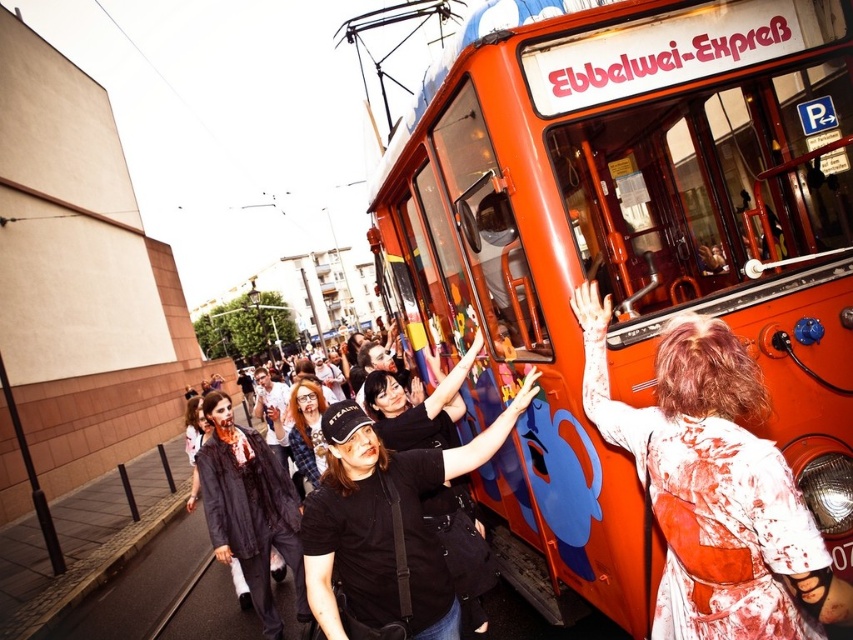
You are standing at the point marked by the coordinates point (625, 248). What object is directly in front of you?

The orange painted metal tram at center is directly in front of you at point (625, 248).

You are a photographer trying to capture a photo of the orange painted metal tram at center and the plaid fabric shirt at center. Which object should you focus on first if you want to ensure both are in focus without adjusting the camera settings?

The orange painted metal tram at center is much taller than the plaid fabric shirt at center, so focusing on the tram first would ensure both are in focus since it is farther away.

You are a photographer standing in the middle of the street. You want to take a photo of the orange painted metal tram at center and the plaid fabric shirt at center. Which object should you focus on first if you want to capture both in the same frame without moving the camera?

You should focus on the plaid fabric shirt at center first because the orange painted metal tram at center is above it, so adjusting the focus to the lower object ensures both are in the frame.